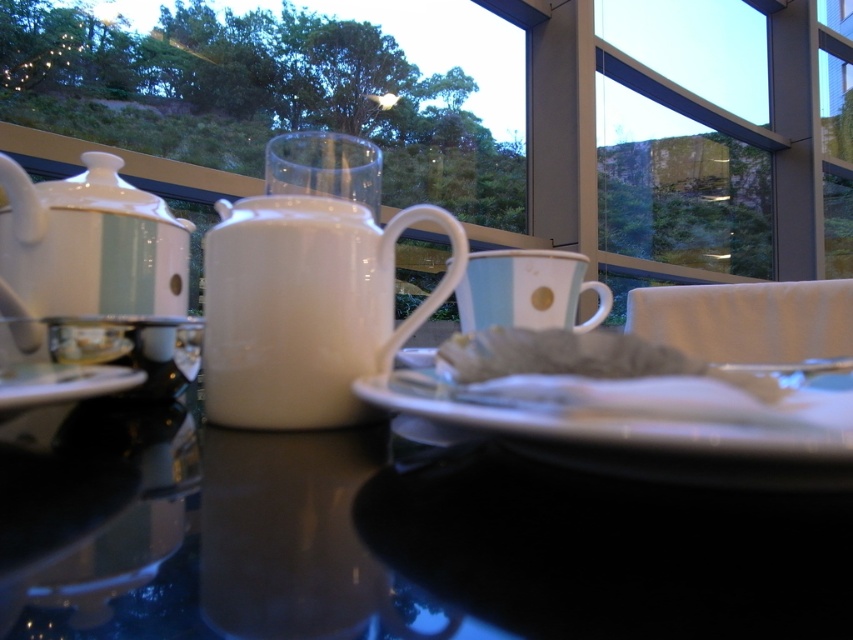
Question: Does white glossy plate at center come in front of white matte napkin at center?

Choices:
 (A) yes
 (B) no

Answer: (A)

Question: Can you confirm if glossy ceramic mug at upper center is bigger than white glossy plate at center?

Choices:
 (A) yes
 (B) no

Answer: (A)

Question: Based on their relative distances, which object is farther from the white glossy saucer at lower left?

Choices:
 (A) white glossy teapot at left
 (B) transparent glass at center
 (C) white glossy plate at center
 (D) white glossy mug at center

Answer: (B)

Question: Which point is closer to the camera?

Choices:
 (A) glossy ceramic mug at upper center
 (B) light blue ceramic mug at center
 (C) transparent glass at center
 (D) white glossy plate at center

Answer: (A)

Question: Based on their relative distances, which object is nearer to the light blue ceramic mug at center?

Choices:
 (A) white matte napkin at center
 (B) transparent glass at center
 (C) glossy ceramic mug at upper center
 (D) white glossy mug at center

Answer: (A)

Question: Does light blue ceramic mug at center appear over transparent glass at center?

Choices:
 (A) no
 (B) yes

Answer: (A)